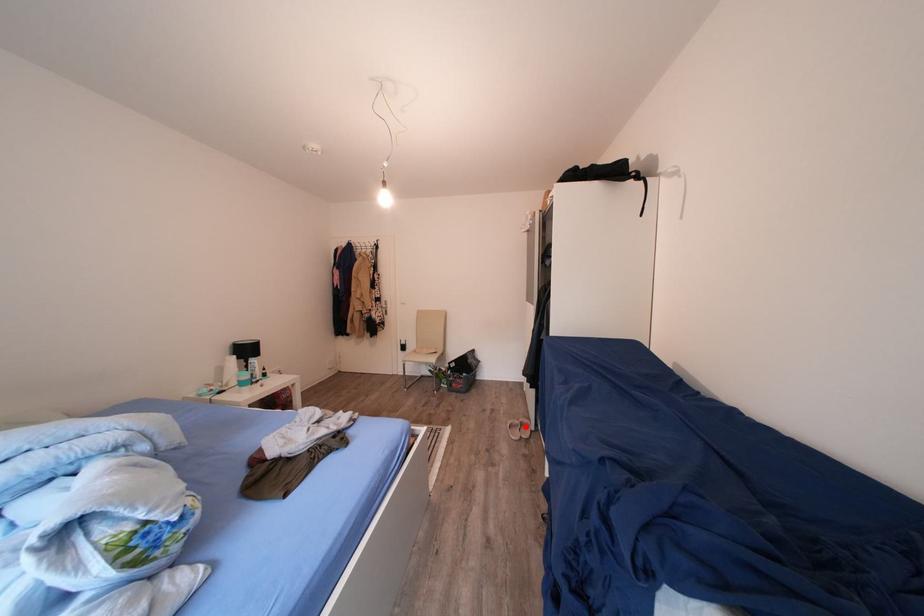
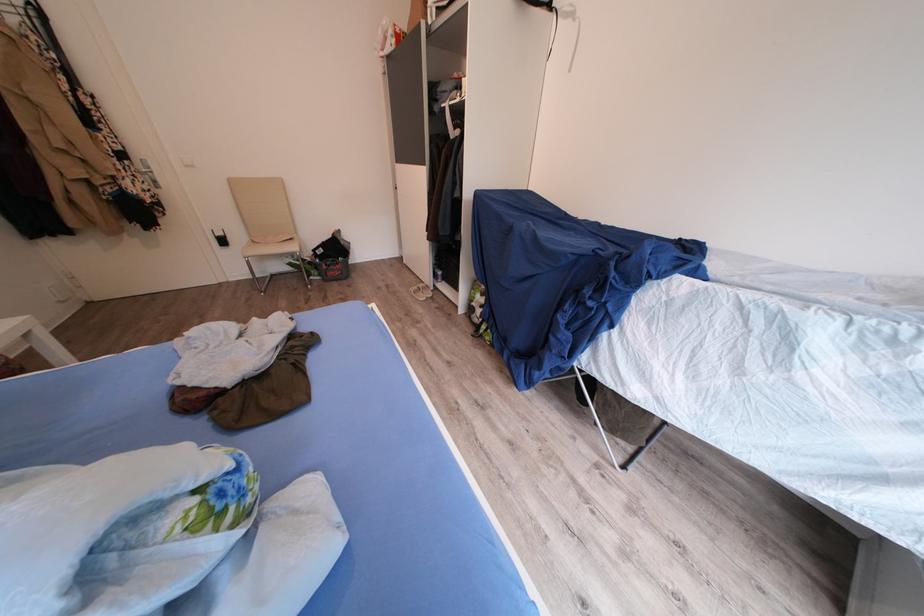
Find the pixel in the second image that matches the highlighted location in the first image.

(424, 293)